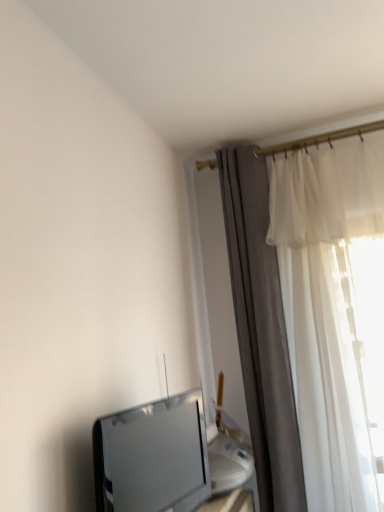
Question: Is point (183, 398) positioned closer to the camera than point (248, 352)?

Choices:
 (A) farther
 (B) closer

Answer: (B)

Question: Looking at their shapes, would you say matte silver tv at lower left is wider or thinner than silky white curtain at right?

Choices:
 (A) wide
 (B) thin

Answer: (B)

Question: From the image's perspective, is matte silver tv at lower left above or below silky white curtain at right?

Choices:
 (A) above
 (B) below

Answer: (B)

Question: In terms of size, does silky white curtain at right appear bigger or smaller than matte silver tv at lower left?

Choices:
 (A) small
 (B) big

Answer: (B)

Question: Is silky white curtain at right taller or shorter than matte silver tv at lower left?

Choices:
 (A) tall
 (B) short

Answer: (A)

Question: Relative to matte silver tv at lower left, is silky white curtain at right in front or behind?

Choices:
 (A) behind
 (B) front

Answer: (A)

Question: In terms of width, does silky white curtain at right look wider or thinner when compared to matte silver tv at lower left?

Choices:
 (A) wide
 (B) thin

Answer: (A)